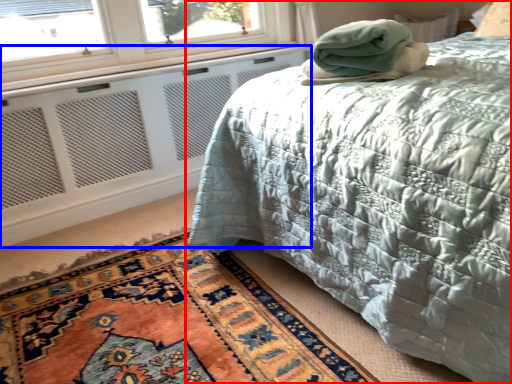
Question: Among these objects, which one is farthest to the camera, bed (highlighted by a red box) or radiator (highlighted by a blue box)?

Choices:
 (A) bed
 (B) radiator

Answer: (B)